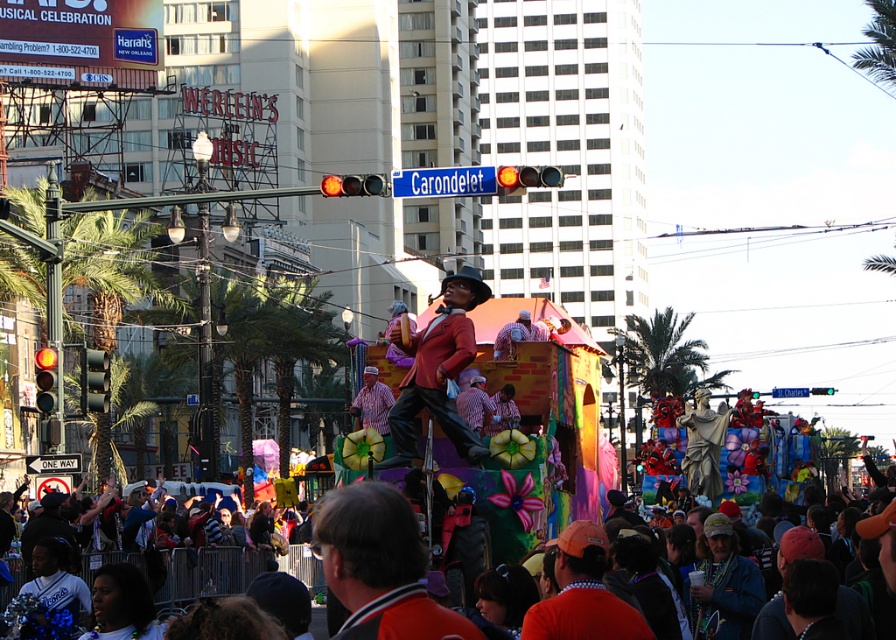
In the festive New Orleans street scene, you see an orange jersey at center and an orange fabric at center. Which one is located more to the left?

The orange jersey at center is positioned on the left side of orange fabric at center, so the orange jersey at center is more to the left.

From the picture: You are a photographer trying to capture a clear shot of both the matte red suit at center and the orange fabric at center from your position on the sidewalk. Which object will appear larger in your photo?

The matte red suit at center will appear larger in the photo because it is much taller than the orange fabric at center.